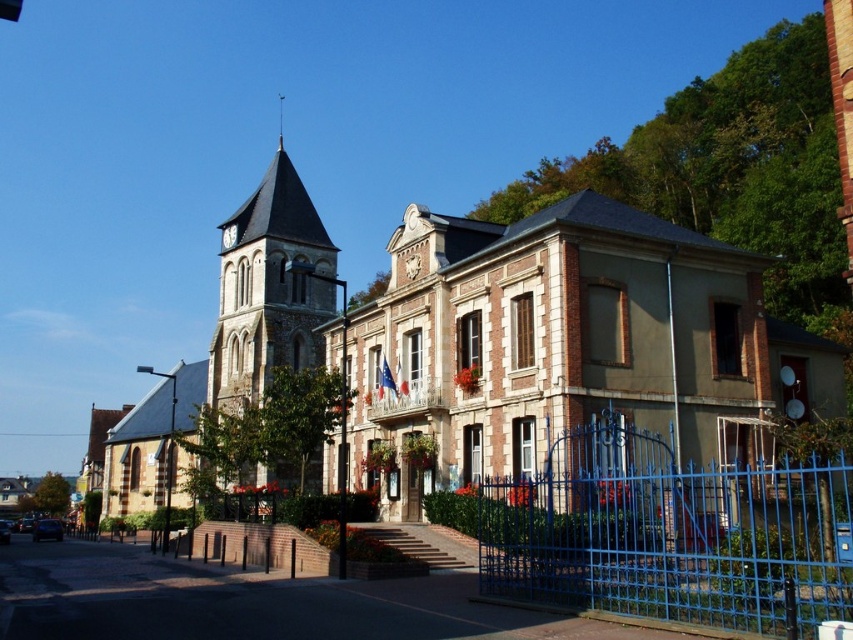
Question: Does brick church at center appear on the right side of white clock tower at upper center?

Choices:
 (A) yes
 (B) no

Answer: (A)

Question: Does stone clock tower at center-left have a smaller size compared to french flag at center?

Choices:
 (A) no
 (B) yes

Answer: (A)

Question: Among these points, which one is nearest to the camera?

Choices:
 (A) (631, 413)
 (B) (245, 333)

Answer: (A)

Question: Among these objects, which one is farthest from the camera?

Choices:
 (A) brick church at center
 (B) blue metal gate at center

Answer: (A)

Question: Is brick church at center above blue metal gate at center?

Choices:
 (A) yes
 (B) no

Answer: (A)

Question: Considering the real-world distances, which object is closest to the blue metal gate at center?

Choices:
 (A) brick church at center
 (B) stone clock tower at center-left
 (C) white clock tower at upper center

Answer: (A)